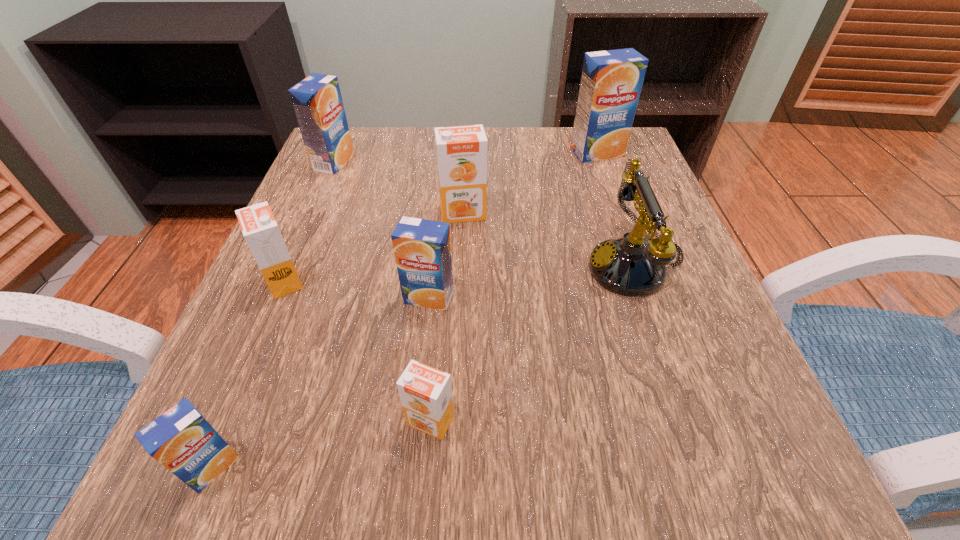
Where is `free space that satisfies the following two spatial constraints: 1. on the dial of the telephone; 2. on the front side of the smallest blue orange_juice`? free space that satisfies the following two spatial constraints: 1. on the dial of the telephone; 2. on the front side of the smallest blue orange_juice is located at coordinates (705, 466).